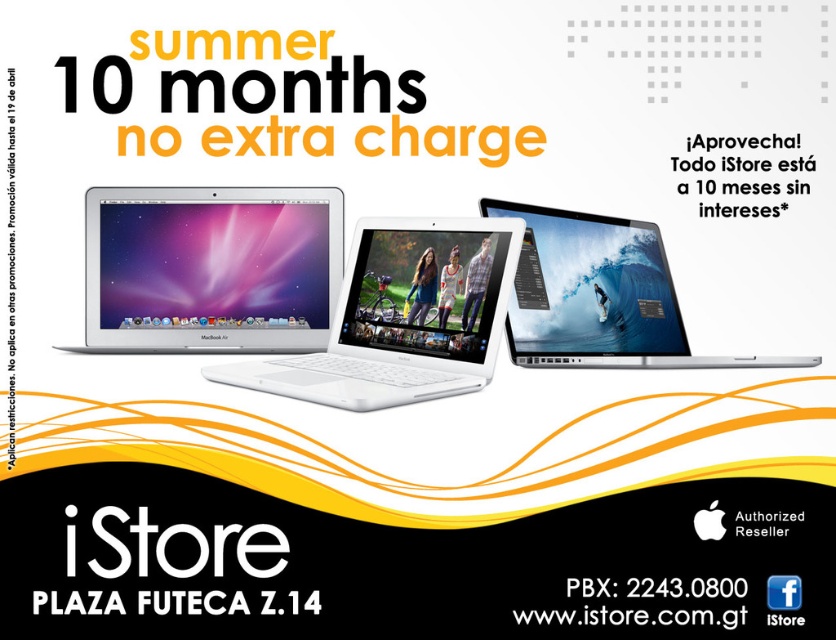
Can you confirm if white glossy laptop at center is positioned to the left of sleek silver laptop at center?

Correct, you'll find white glossy laptop at center to the left of sleek silver laptop at center.

Does white glossy laptop at center appear over sleek silver laptop at center?

Incorrect, white glossy laptop at center is not positioned above sleek silver laptop at center.

Between point (498, 308) and point (589, 273), which one is positioned in front?

Positioned in front is point (498, 308).

Locate an element on the screen. white glossy laptop at center is located at coordinates (404, 316).

Can you confirm if satin silver macbook air at center is positioned to the left of sleek silver laptop at center?

Indeed, satin silver macbook air at center is positioned on the left side of sleek silver laptop at center.

Which is in front, point (247, 307) or point (628, 264)?

Positioned in front is point (247, 307).

Which is behind, point (253, 202) or point (615, 262)?

Positioned behind is point (615, 262).

In order to click on satin silver macbook air at center in this screenshot , I will do `click(210, 268)`.

Locate an element on the screen. satin silver macbook air at center is located at coordinates (210, 268).

Is satin silver macbook air at center to the right of white glossy laptop at center from the viewer's perspective?

A: Incorrect, satin silver macbook air at center is not on the right side of white glossy laptop at center.

Locate an element on the screen. Image resolution: width=836 pixels, height=640 pixels. satin silver macbook air at center is located at coordinates (210, 268).

This screenshot has height=640, width=836. I want to click on satin silver macbook air at center, so click(x=210, y=268).